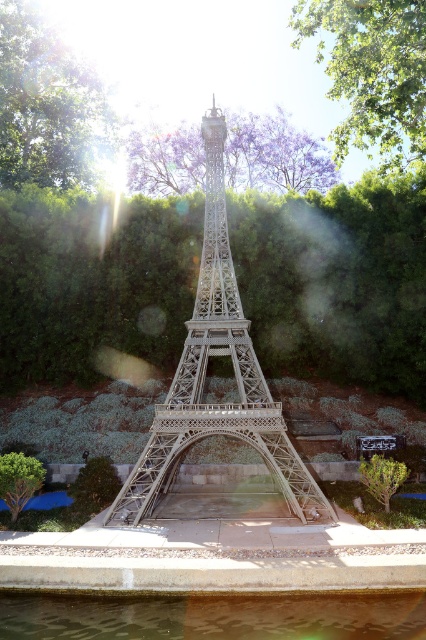
Question: Is clear glass water at lower center positioned in front of green leafy tree at upper left?

Choices:
 (A) no
 (B) yes

Answer: (B)

Question: Is green leafy hedge at center further to camera compared to clear glass water at lower center?

Choices:
 (A) no
 (B) yes

Answer: (B)

Question: Which object is farther from the camera taking this photo?

Choices:
 (A) green leafy tree at upper center
 (B) green leafy tree at upper left
 (C) purple leafy tree at upper center
 (D) metallic silver eiffel tower at center

Answer: (C)

Question: Which object is closer to the camera taking this photo?

Choices:
 (A) green leafy tree at upper left
 (B) purple leafy tree at upper center
 (C) clear glass water at lower center
 (D) green leafy hedge at center

Answer: (C)

Question: Which of the following is the farthest from the observer?

Choices:
 (A) purple leafy tree at upper center
 (B) green leafy hedge at center
 (C) clear glass water at lower center

Answer: (A)

Question: Is green leafy hedge at center to the right of metallic silver eiffel tower at center from the viewer's perspective?

Choices:
 (A) yes
 (B) no

Answer: (B)